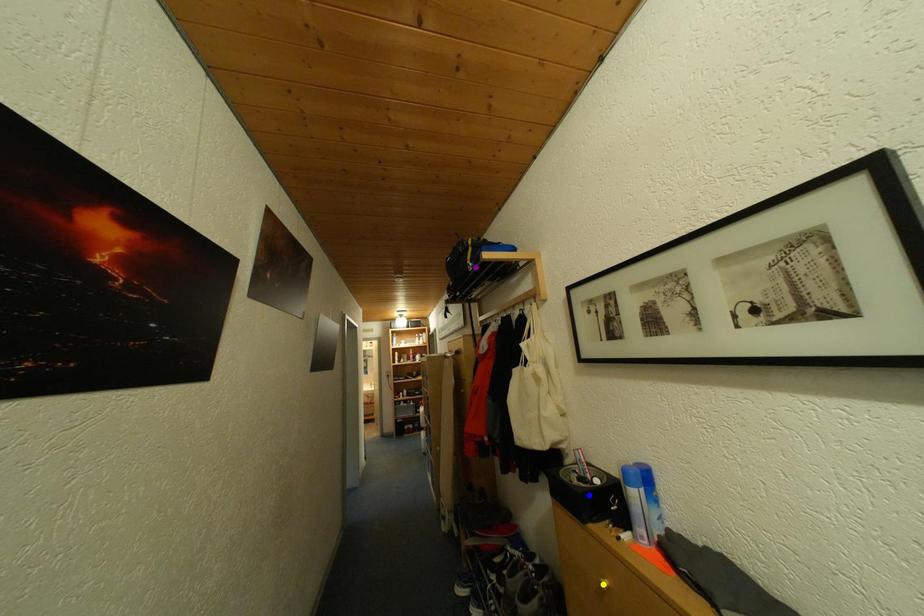
Order these from nearest to farthest:
blue point | yellow point | purple point

purple point
blue point
yellow point